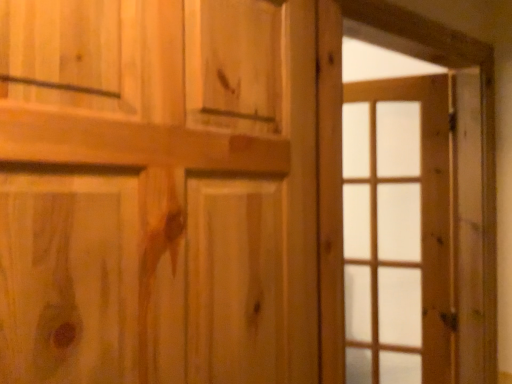
Measure the distance between natural wood door at center and camera.

They are 21.98 inches apart.

This screenshot has height=384, width=512. What are the coordinates of `clear glass door at right` in the screenshot? It's located at (383, 220).

Is clear glass door at right bigger or smaller than natural wood door at center?

Considering their sizes, clear glass door at right takes up less space than natural wood door at center.

Where is `glass door on the right of natural wood door at center`? The height and width of the screenshot is (384, 512). glass door on the right of natural wood door at center is located at coordinates (383, 220).

From a real-world perspective, which object stands above the other?

In real-world perspective, natural wood door at center is above.

From a real-world perspective, which is physically below, wooden barn door at right or natural wood door at center?

wooden barn door at right is physically lower.

Considering the positions of objects wooden barn door at right and natural wood door at center in the image provided, who is behind, wooden barn door at right or natural wood door at center?

wooden barn door at right is more distant.

Would you say wooden barn door at right is inside or outside natural wood door at center?

wooden barn door at right is not inside natural wood door at center, it's outside.

Considering the relative sizes of wooden barn door at right and natural wood door at center in the image provided, is wooden barn door at right bigger than natural wood door at center?

Actually, wooden barn door at right might be smaller than natural wood door at center.

Based on the photo, can you confirm if clear glass door at right is bigger than wooden barn door at right?

Actually, clear glass door at right might be smaller than wooden barn door at right.

How different are the orientations of clear glass door at right and wooden barn door at right in degrees?

The angular difference between clear glass door at right and wooden barn door at right is 50.8 degrees.

Is clear glass door at right completely or partially outside of wooden barn door at right?

Indeed, clear glass door at right is completely outside wooden barn door at right.

Is clear glass door at right facing towards wooden barn door at right?

Yes, clear glass door at right is turned towards wooden barn door at right.

From the picture: From a real-world perspective, who is located lower, natural wood door at center or wooden barn door at right?

wooden barn door at right, from a real-world perspective.

Does natural wood door at center appear on the left side of wooden barn door at right?

Yes.

Is natural wood door at center not close to wooden barn door at right?

No, there isn't a large distance between natural wood door at center and wooden barn door at right.

Is natural wood door at center turned away from wooden barn door at right?

No, natural wood door at center is not facing away from wooden barn door at right.

In the image, is wooden barn door at right on the left side or the right side of clear glass door at right?

wooden barn door at right is to the left of clear glass door at right.

Is wooden barn door at right inside the boundaries of clear glass door at right, or outside?

wooden barn door at right is not inside clear glass door at right, it's outside.

Does point (489, 46) appear closer or farther from the camera than point (388, 162)?

Point (489, 46) is positioned closer to the camera compared to point (388, 162).

From a real-world perspective, is wooden barn door at right below clear glass door at right?

Actually, wooden barn door at right is physically above clear glass door at right in the real world.

Is natural wood door at center beside clear glass door at right?

natural wood door at center is not next to clear glass door at right, and they're not touching.

Do you think natural wood door at center is within clear glass door at right, or outside of it?

natural wood door at center cannot be found inside clear glass door at right.

Between natural wood door at center and clear glass door at right, which one has more height?

Standing taller between the two is clear glass door at right.

Which object is closer to the camera, natural wood door at center or clear glass door at right?

Positioned in front is natural wood door at center.

The height and width of the screenshot is (384, 512). I want to click on glass door below the natural wood door at center (from the image's perspective), so click(383, 220).

What are the coordinates of `barn door behind the natural wood door at center` in the screenshot? It's located at (481, 122).

Looking at the image, which one is located closer to clear glass door at right, natural wood door at center or wooden barn door at right?

wooden barn door at right.

Looking at the image, which one is located further to wooden barn door at right, clear glass door at right or natural wood door at center?

clear glass door at right.

Consider the image. When comparing their distances from natural wood door at center, does clear glass door at right or wooden barn door at right seem further?

clear glass door at right is positioned further to the anchor natural wood door at center.

Which object lies nearer to the anchor point wooden barn door at right, natural wood door at center or clear glass door at right?

natural wood door at center is positioned closer to the anchor wooden barn door at right.

Which object lies nearer to the anchor point natural wood door at center, wooden barn door at right or clear glass door at right?

wooden barn door at right.

Consider the image. Which object lies nearer to the anchor point clear glass door at right, wooden barn door at right or natural wood door at center?

The object closer to clear glass door at right is wooden barn door at right.

Find the location of a particular element. The width and height of the screenshot is (512, 384). barn door between natural wood door at center and clear glass door at right in the front-back direction is located at coordinates (481, 122).